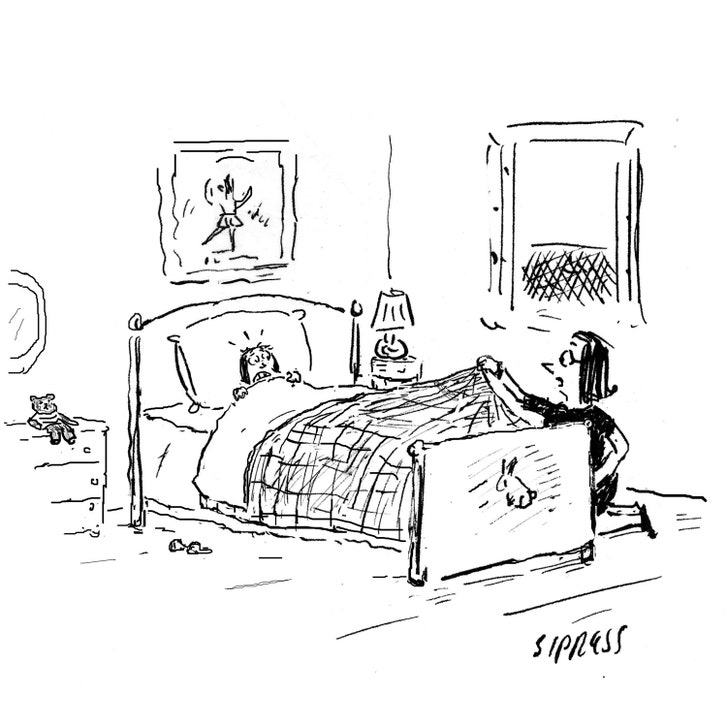
Locate an element on the screen. This screenshot has height=727, width=727. slippers is located at coordinates (179, 546), (192, 550).